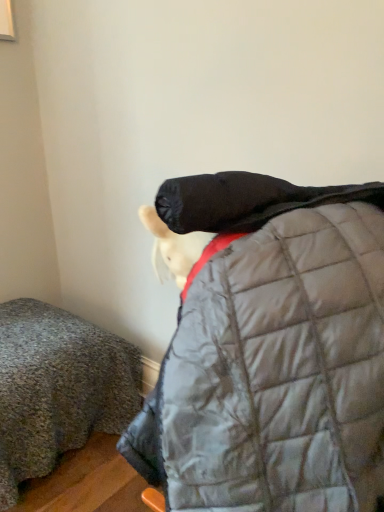
Question: Based on their positions, is silver quilted jacket at center located to the left or right of textured gray blanket at lower left?

Choices:
 (A) left
 (B) right

Answer: (B)

Question: Would you say silver quilted jacket at center is inside or outside textured gray blanket at lower left?

Choices:
 (A) inside
 (B) outside

Answer: (B)

Question: In the image, is silver quilted jacket at center positioned in front of or behind textured gray blanket at lower left?

Choices:
 (A) behind
 (B) front

Answer: (B)

Question: Looking at their shapes, would you say textured gray blanket at lower left is wider or thinner than silver quilted jacket at center?

Choices:
 (A) thin
 (B) wide

Answer: (B)

Question: In the image, is textured gray blanket at lower left on the left side or the right side of silver quilted jacket at center?

Choices:
 (A) right
 (B) left

Answer: (B)

Question: Would you say textured gray blanket at lower left is inside or outside silver quilted jacket at center?

Choices:
 (A) inside
 (B) outside

Answer: (B)

Question: Based on their sizes in the image, would you say textured gray blanket at lower left is bigger or smaller than silver quilted jacket at center?

Choices:
 (A) big
 (B) small

Answer: (A)